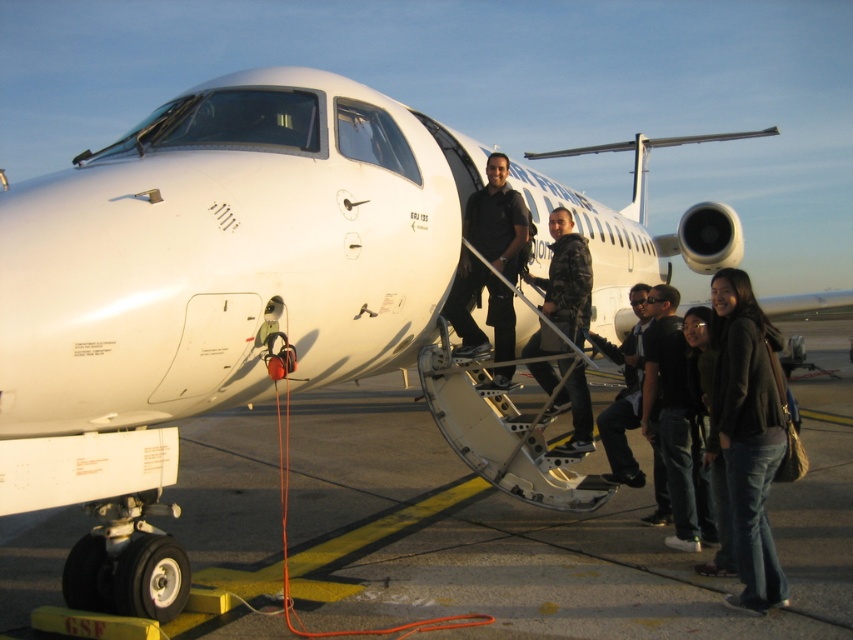
You are a photographer standing at the airport gate. You notice two people in the scene wearing a dark gray sweater at lower right and dark blue jeans at center. Which clothing item appears smaller in size?

The dark gray sweater at lower right is smaller than the dark blue jeans at center.